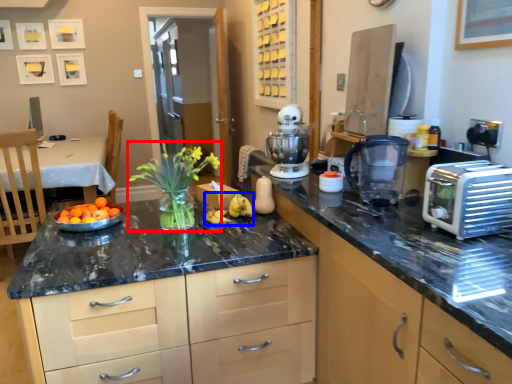
Question: Which of the following is the closest to the observer, floral arrangement (highlighted by a red box) or banana (highlighted by a blue box)?

Choices:
 (A) floral arrangement
 (B) banana

Answer: (A)